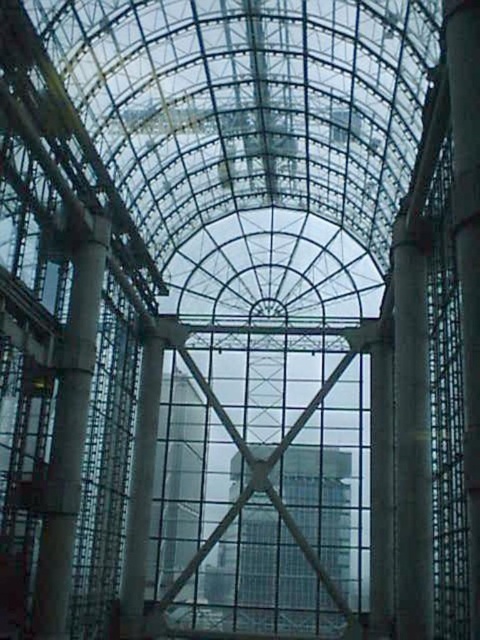
Measure the distance between concrete pillar at left and smooth gray concrete pillar at right.

concrete pillar at left is 35.10 meters from smooth gray concrete pillar at right.

Is concrete pillar at left above smooth gray concrete pillar at right?

No, concrete pillar at left is not above smooth gray concrete pillar at right.

Where is `concrete pillar at left`? concrete pillar at left is located at coordinates (69, 435).

Does point (398, 604) come behind point (465, 179)?

Yes, point (398, 604) is behind point (465, 179).

Locate an element on the screen. Image resolution: width=480 pixels, height=640 pixels. smooth concrete pillar at center is located at coordinates (411, 433).

Is smooth concrete pillar at center to the right of concrete pillar at left from the viewer's perspective?

Indeed, smooth concrete pillar at center is positioned on the right side of concrete pillar at left.

Is the position of smooth concrete pillar at center less distant than that of concrete pillar at left?

No.

Who is more distant from viewer, (408, 419) or (51, 628)?

The point (408, 419) is more distant.

Locate an element on the screen. The image size is (480, 640). smooth concrete pillar at center is located at coordinates (411, 433).